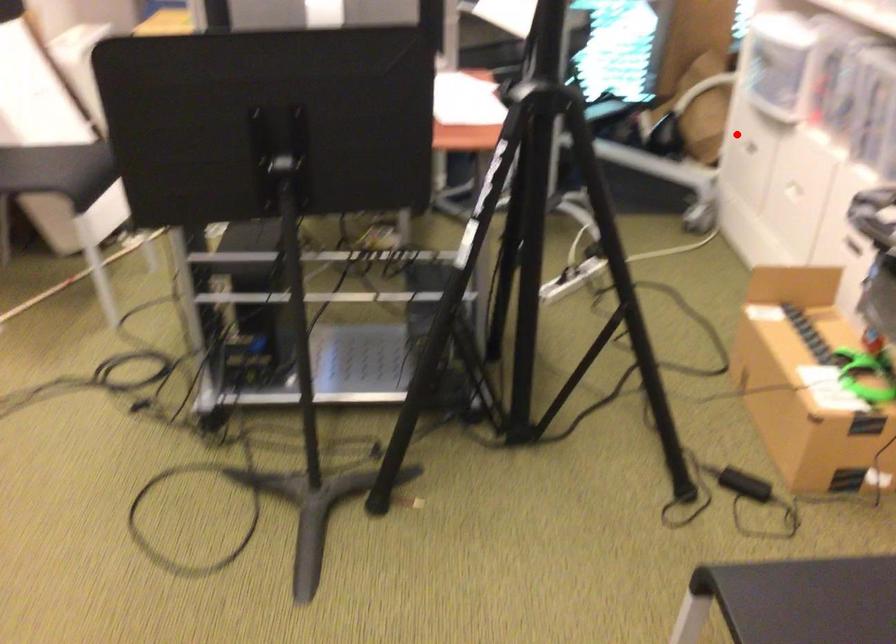
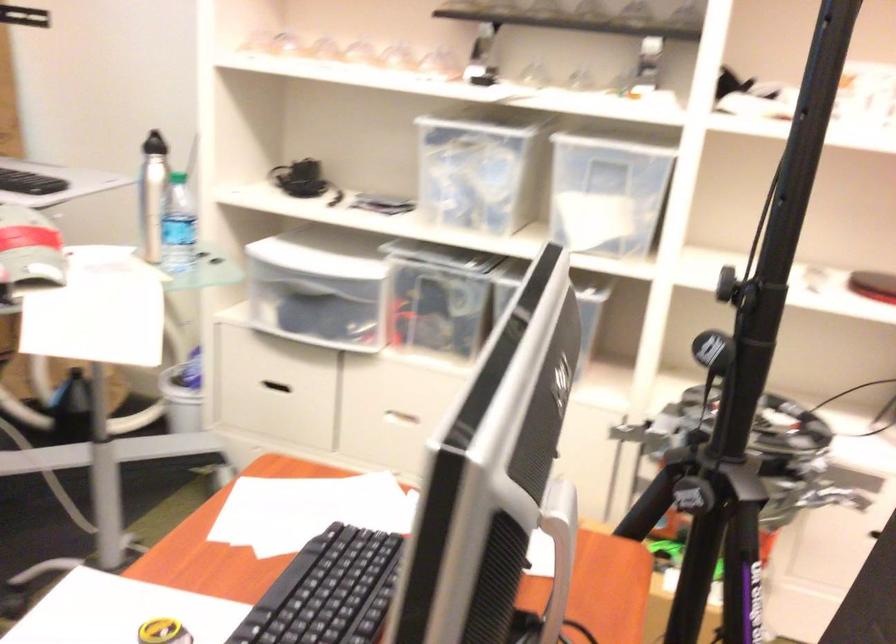
Question: I am providing you with two images of the same scene from different viewpoints. In image1, a red point is highlighted. Considering the same 3D point in image2, which of the following is correct?

Choices:
 (A) It is closer
 (B) It is farther

Answer: (A)